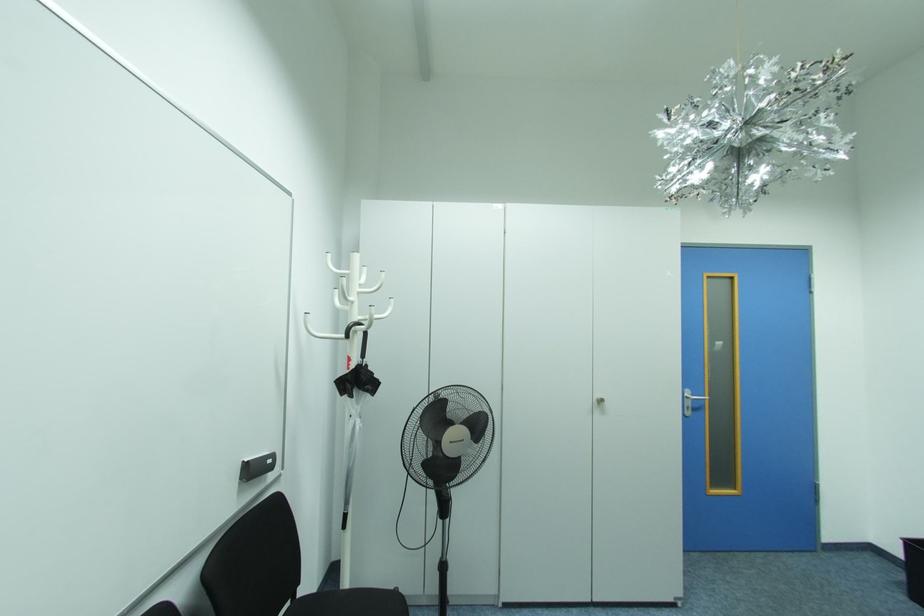
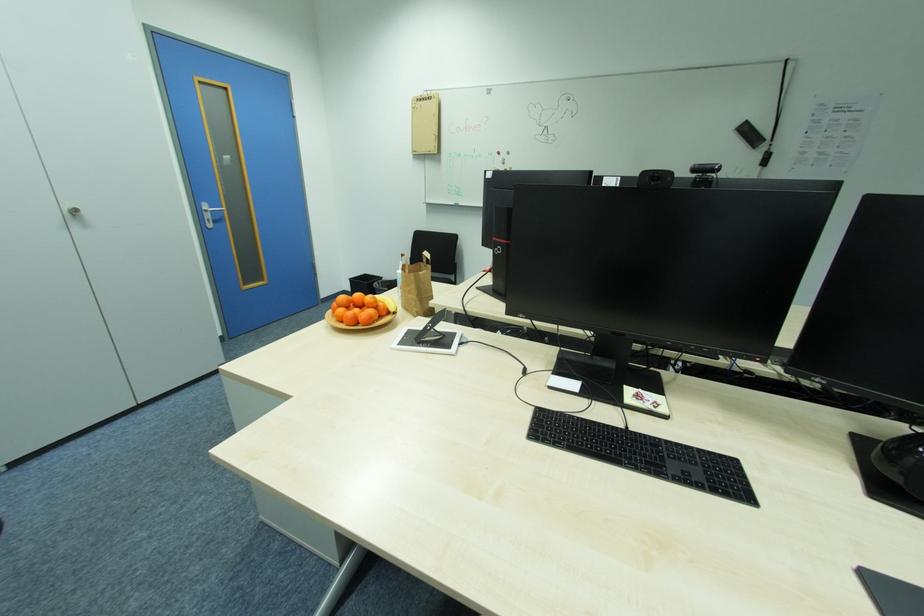
First-person continuous shooting, in which direction is the camera rotating?

The rotation direction of the camera is right-down.